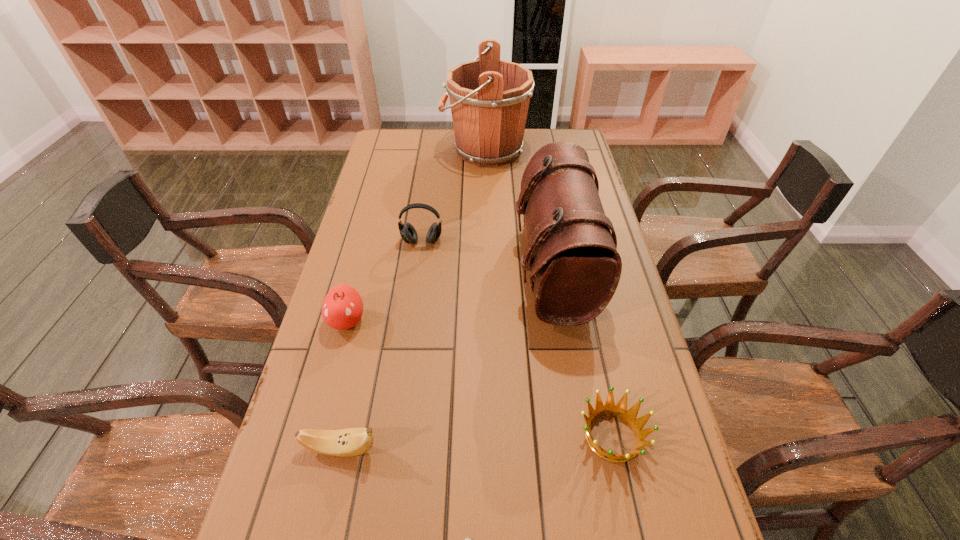
The image size is (960, 540). I want to click on free space that is in between the sixth tallest object and the headset, so click(517, 339).

You are a GUI agent. You are given a task and a screenshot of the screen. Output one action in this format:
    pyautogui.click(x=<x>, y=<y>)
    Task: Click on the vacant area that lies between the bucket and the banana
    Image resolution: width=960 pixels, height=540 pixels.
    Given the screenshot: What is the action you would take?
    pyautogui.click(x=413, y=299)

Where is `unoccupied area between the bucket and the third tallest object`? The width and height of the screenshot is (960, 540). unoccupied area between the bucket and the third tallest object is located at coordinates click(454, 195).

Where is `free space between the sixth tallest object and the banana`? The width and height of the screenshot is (960, 540). free space between the sixth tallest object and the banana is located at coordinates (476, 442).

Identify which object is the fourth closest to the nearest object. Please provide its 2D coordinates. Your answer should be formatted as a tuple, i.e. [(x, y)], where the tuple contains the x and y coordinates of a point satisfying the conditions above.

[(342, 308)]

Identify which object is located as the nearest to the satchel. Please provide its 2D coordinates. Your answer should be formatted as a tuple, i.e. [(x, y)], where the tuple contains the x and y coordinates of a point satisfying the conditions above.

[(619, 410)]

Locate an element on the screen. The width and height of the screenshot is (960, 540). vacant space that satisfies the following two spatial constraints: 1. on the ear cups of the third tallest object; 2. on the left side of the second shortest object is located at coordinates (396, 436).

You are a GUI agent. You are given a task and a screenshot of the screen. Output one action in this format:
    pyautogui.click(x=<x>, y=<y>)
    Task: Click on the vacant point that satisfies the following two spatial constraints: 1. on the front-facing side of the satchel; 2. on the back side of the second shortest object
    The width and height of the screenshot is (960, 540).
    Given the screenshot: What is the action you would take?
    pyautogui.click(x=582, y=436)

Locate an element on the screen. This screenshot has height=540, width=960. free space that satisfies the following two spatial constraints: 1. on the front-facing side of the crown; 2. on the left side of the satchel is located at coordinates (582, 436).